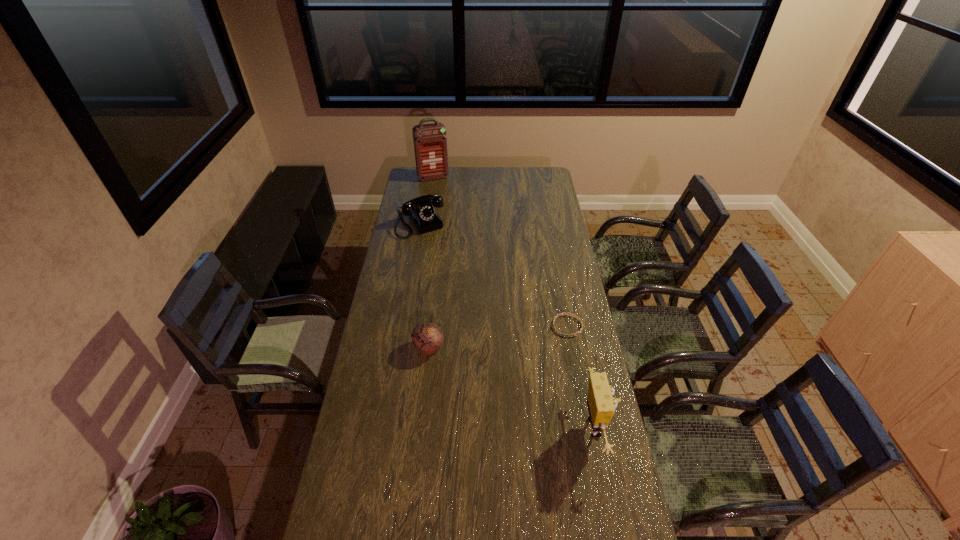
Where is `vacant space on the desktop that is between the second shortest object and the sponge and is positioned on the dial of the telephone`? vacant space on the desktop that is between the second shortest object and the sponge and is positioned on the dial of the telephone is located at coordinates (530, 395).

The height and width of the screenshot is (540, 960). I want to click on vacant space on the desktop that is between the muffin and the second tallest object and is positioned on the front-facing side of the farthest object, so click(519, 390).

At what (x,y) coordinates should I click in order to perform the action: click on vacant space on the desktop that is between the second shortest object and the nearest object and is positioned on the surface of the bracelet showing star-shaped elements. Please return your answer as a coordinate pair (x, y). The width and height of the screenshot is (960, 540). Looking at the image, I should click on (491, 377).